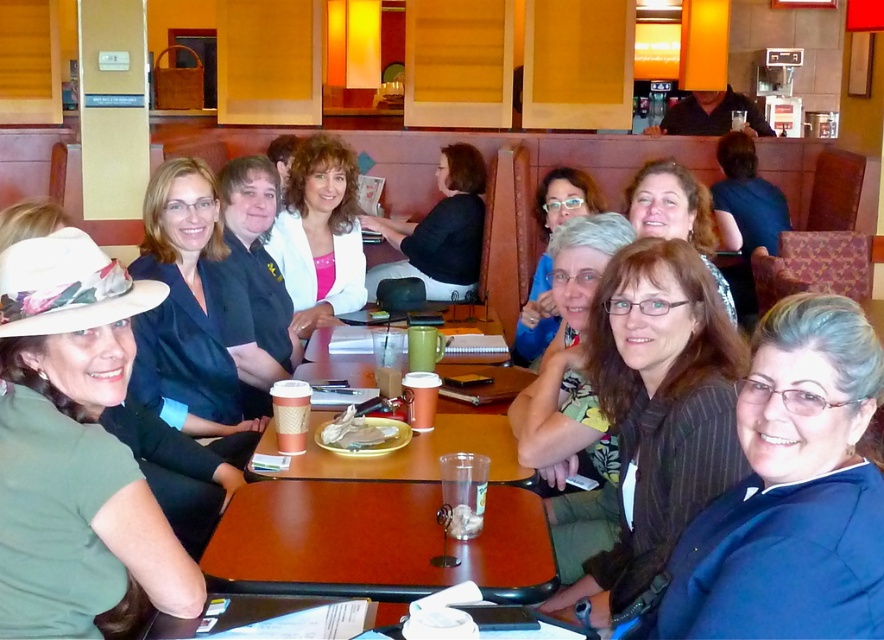
You are a server in a restaurant and need to place a new order on the table. Where should you place it in relation to the wooden table at center and the black matte shirt at center?

The wooden table at center is located below the black matte shirt at center, so you should place the new order on the wooden table at center, which is beneath the shirt.